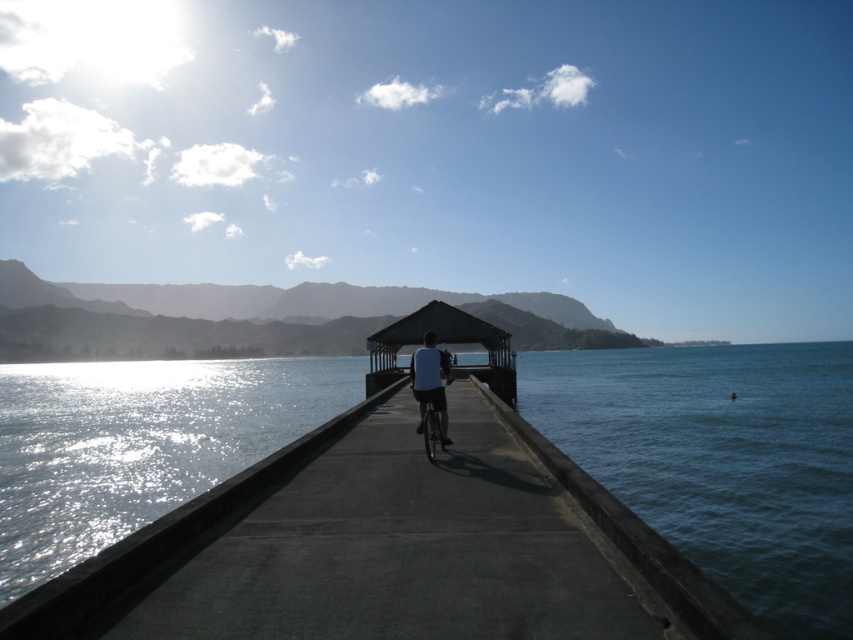
Question: Can you confirm if blue water at lower right is positioned below shiny metallic bicycle at center?

Choices:
 (A) no
 (B) yes

Answer: (B)

Question: Among these points, which one is nearest to the camera?

Choices:
 (A) (798, 502)
 (B) (318, 536)

Answer: (B)

Question: Does white matte shirt at center come in front of shiny metallic bicycle at center?

Choices:
 (A) no
 (B) yes

Answer: (A)

Question: Which point is farther to the camera?

Choices:
 (A) (239, 637)
 (B) (503, 362)

Answer: (B)

Question: Is matte black shelter at center to the right of white matte shirt at center from the viewer's perspective?

Choices:
 (A) yes
 (B) no

Answer: (A)

Question: Which point is closer to the camera?

Choices:
 (A) shiny metallic bicycle at center
 (B) matte black shelter at center
 (C) blue water at lower right
 (D) white matte shirt at center

Answer: (C)